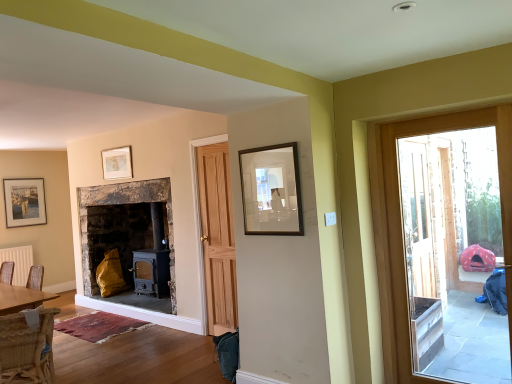
Question: Based on their positions, is wooden door at right located to the left or right of wooden frame at upper center, which ranks as the first picture frame in right-to-left order?

Choices:
 (A) right
 (B) left

Answer: (A)

Question: In terms of size, does wooden door at right appear bigger or smaller than wooden frame at upper center, acting as the third picture frame starting from the left?

Choices:
 (A) small
 (B) big

Answer: (B)

Question: Which object is positioned closest to the matte black picture frame at upper left, which is counted as the 3th picture frame, starting from the right?

Choices:
 (A) wooden frame at upper center, which ranks as the first picture frame in right-to-left order
 (B) matte gold picture frame at upper center, which is the 2th picture frame from left to right
 (C) wooden door at right
 (D) woven wicker chair at lower left
 (E) white matte radiator at lower left

Answer: (B)

Question: Considering the real-world distances, which object is closest to the matte black picture frame at upper left, which appears as the first picture frame when viewed from the left?

Choices:
 (A) wooden frame at upper center, the 1th picture frame when ordered from front to back
 (B) woven wicker chair at lower left
 (C) wooden door at right
 (D) matte gold picture frame at upper center, acting as the second picture frame starting from the back
 (E) white matte radiator at lower left

Answer: (D)